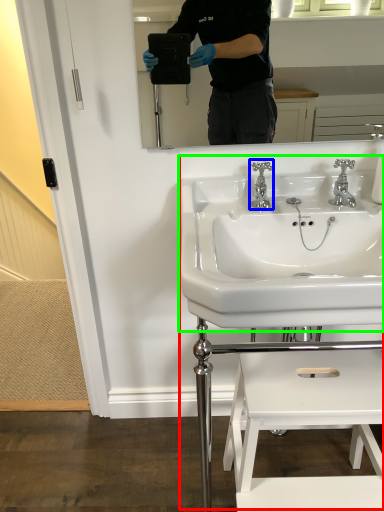
Question: Considering the real-world distances, which object is closest to sink (highlighted by a red box)? tap (highlighted by a blue box) or sink (highlighted by a green box).

Choices:
 (A) tap
 (B) sink

Answer: (B)